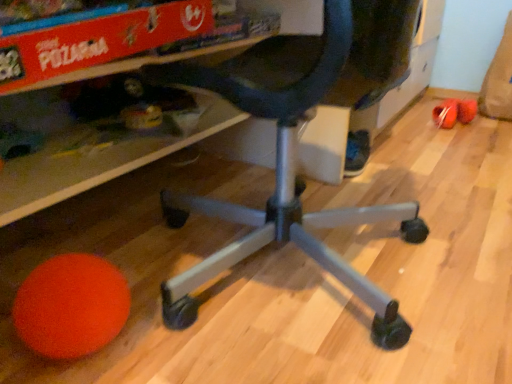
Locate an element on the screen. This screenshot has height=384, width=512. free spot in front of rubberized plastic ball at lower left is located at coordinates (458, 140).